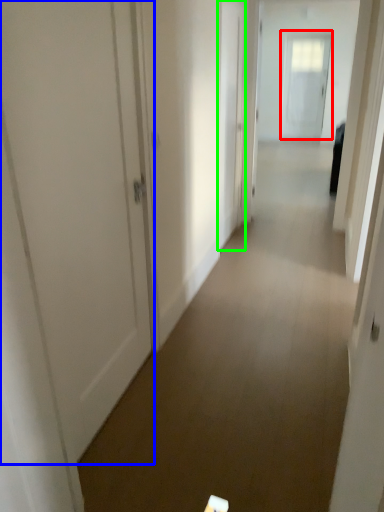
Question: Based on their relative distances, which object is nearer to door (highlighted by a red box)? Choose from door (highlighted by a blue box) and door (highlighted by a green box).

Choices:
 (A) door
 (B) door

Answer: (B)